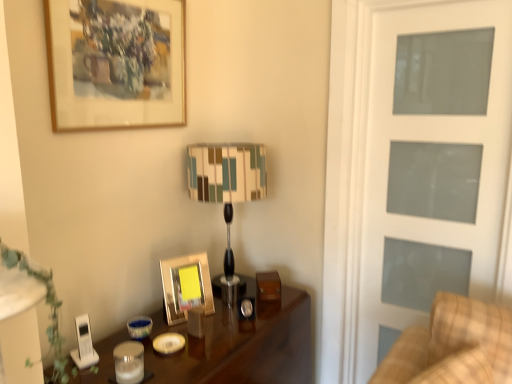
Identify the location of free spot in front of striped fabric lampshade at center. The image size is (512, 384). (230, 317).